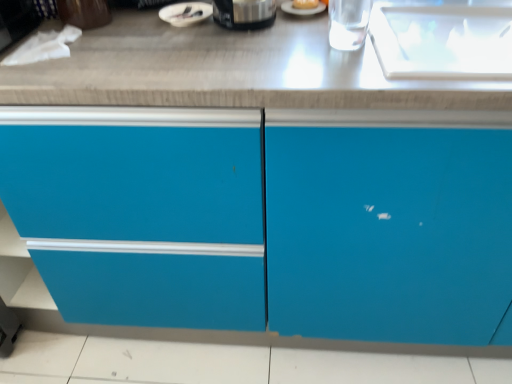
At what (x,y) coordinates should I click in order to perform the action: click on free point to the left of golden bread at center. Please return your answer as a coordinate pair (x, y). Looking at the image, I should click on (241, 23).